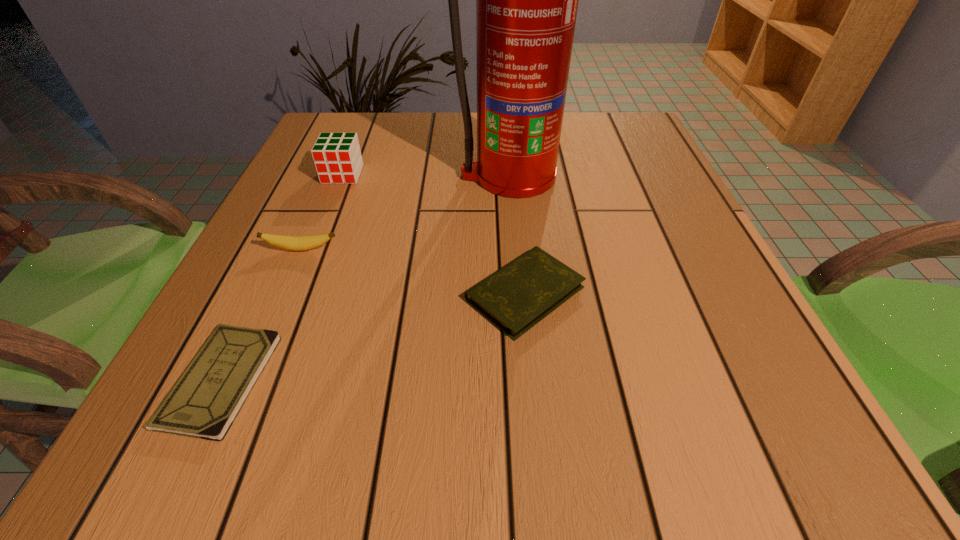
Where is `free spot between the tallest object and the third tallest object`? The height and width of the screenshot is (540, 960). free spot between the tallest object and the third tallest object is located at coordinates (405, 213).

Where is `vacant region between the shortest object and the second shortest object`? This screenshot has height=540, width=960. vacant region between the shortest object and the second shortest object is located at coordinates (373, 336).

The height and width of the screenshot is (540, 960). What are the coordinates of `free space between the second shortest object and the second tallest object` in the screenshot? It's located at (434, 234).

Locate an element on the screen. This screenshot has height=540, width=960. object that is the fourth closest one to the fire extinguisher is located at coordinates (203, 403).

Identify which object is located as the nearest to the diary. Please provide its 2D coordinates. Your answer should be formatted as a tuple, i.e. [(x, y)], where the tuple contains the x and y coordinates of a point satisfying the conditions above.

[(526, 0)]

Locate an element on the screen. vacant space that satisfies the following two spatial constraints: 1. on the instruction side of the fire extinguisher; 2. on the right side of the second shortest object is located at coordinates (520, 293).

You are a GUI agent. You are given a task and a screenshot of the screen. Output one action in this format:
    pyautogui.click(x=<x>, y=<y>)
    Task: Click on the vacant position in the image that satisfies the following two spatial constraints: 1. on the red face of the second tallest object; 2. on the right side of the diary
    Image resolution: width=960 pixels, height=540 pixels.
    Given the screenshot: What is the action you would take?
    pyautogui.click(x=294, y=293)